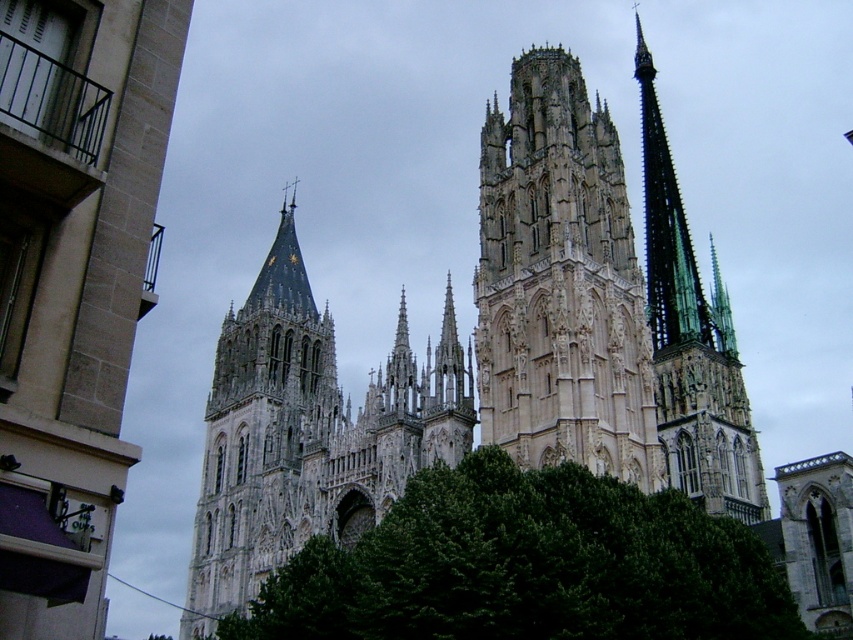
Question: Among these objects, which one is farthest from the camera?

Choices:
 (A) white stone tower at center
 (B) white stone tower at left
 (C) green leafy tree at center

Answer: (B)

Question: Can you confirm if white stone church at center is wider than white stone tower at left?

Choices:
 (A) no
 (B) yes

Answer: (A)

Question: Is white stone tower at center positioned behind white stone tower at left?

Choices:
 (A) yes
 (B) no

Answer: (B)

Question: Considering the real-world distances, which object is closest to the white stone tower at center?

Choices:
 (A) white stone church at center
 (B) green leafy tree at center

Answer: (B)

Question: Can you confirm if white stone church at center is positioned to the left of green copper spire at upper right?

Choices:
 (A) no
 (B) yes

Answer: (B)

Question: Among these objects, which one is nearest to the camera?

Choices:
 (A) white stone church at center
 (B) green copper spire at upper right
 (C) white stone tower at center

Answer: (A)